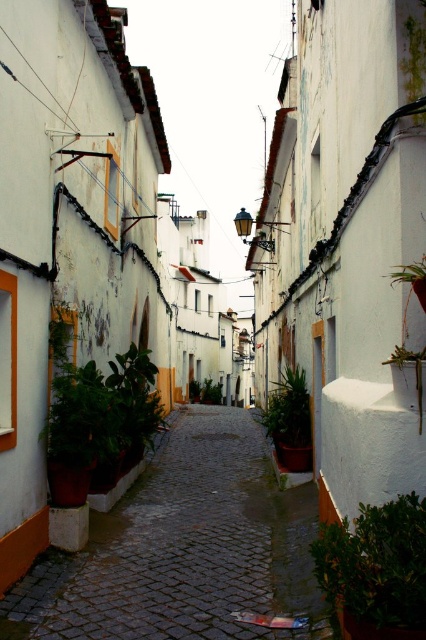
Question: Which point appears farthest from the camera in this image?

Choices:
 (A) (140, 477)
 (B) (327, 536)

Answer: (A)

Question: Can you confirm if green leafy plant at lower right is wider than green matte plant at center?

Choices:
 (A) yes
 (B) no

Answer: (B)

Question: Is green leafy plant at lower right closer to camera compared to green matte plant at center?

Choices:
 (A) no
 (B) yes

Answer: (B)

Question: Considering the real-world distances, which object is farthest from the green matte plant at center?

Choices:
 (A) green leafy plant at center
 (B) smooth cobblestone path at center

Answer: (A)

Question: Does green matte plant at center appear over green leafy plant at center?

Choices:
 (A) no
 (B) yes

Answer: (B)

Question: Which point appears closest to the camera in this image?

Choices:
 (A) (241, 504)
 (B) (394, 570)
 (C) (293, 429)
 (D) (189, 401)

Answer: (B)